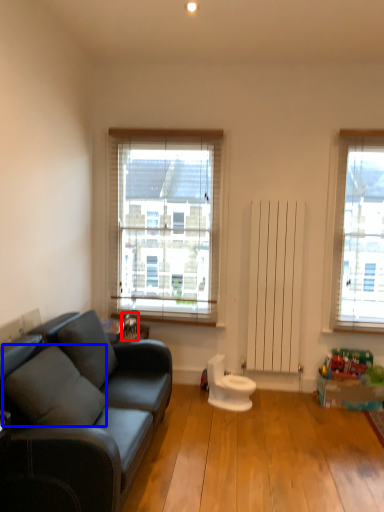
Question: Which object appears farthest to the camera in this image, toy (highlighted by a red box) or pillow (highlighted by a blue box)?

Choices:
 (A) toy
 (B) pillow

Answer: (A)